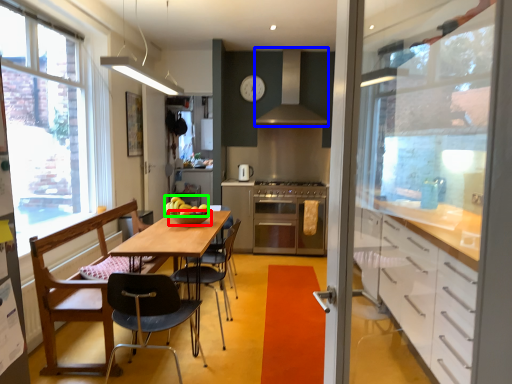
Question: Estimate the real-world distances between objects in this image. Which object is closer to bowl (highlighted by a red box), exhaust hood (highlighted by a blue box) or apple (highlighted by a green box)?

Choices:
 (A) exhaust hood
 (B) apple

Answer: (B)